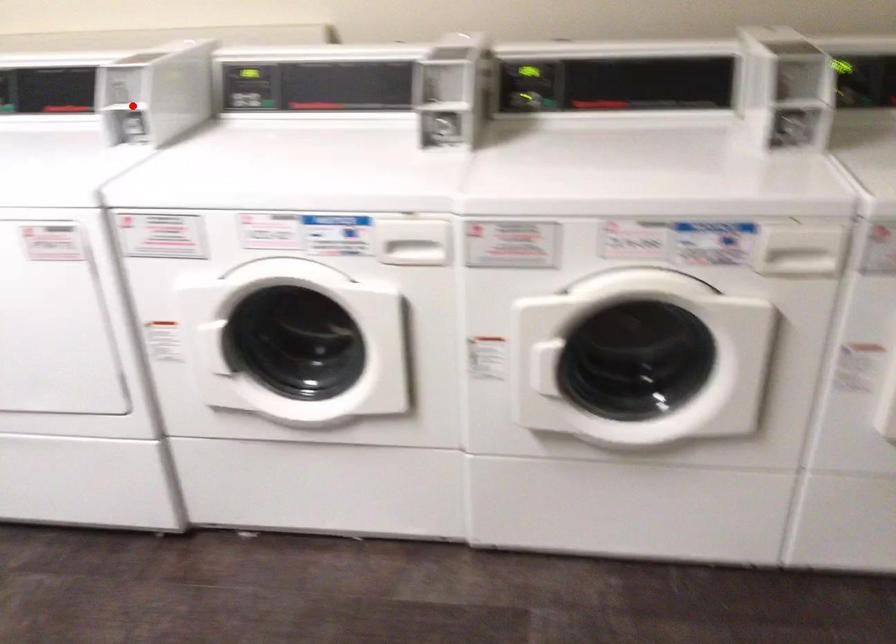
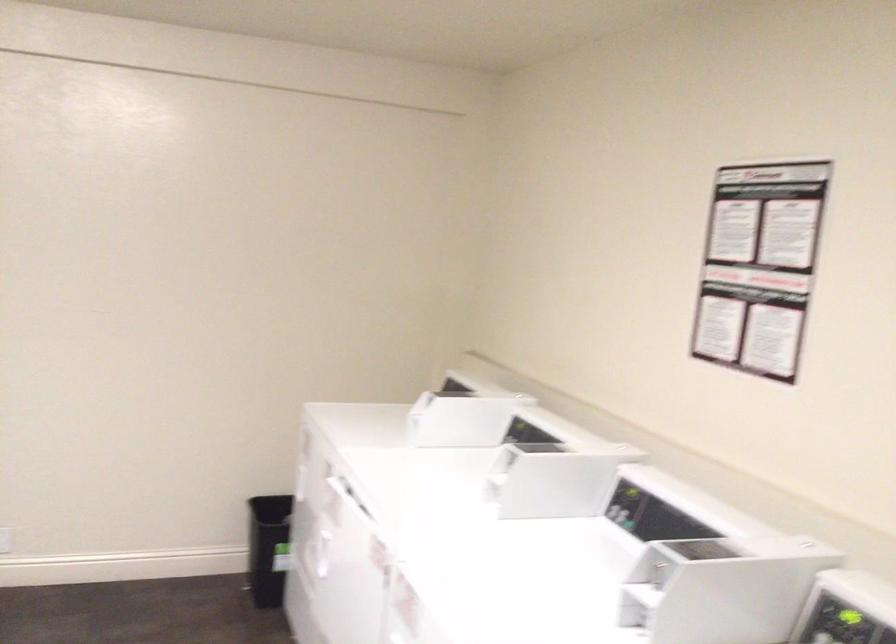
The point at the highlighted location is marked in the first image. Where is the corresponding point in the second image?

(643, 597)